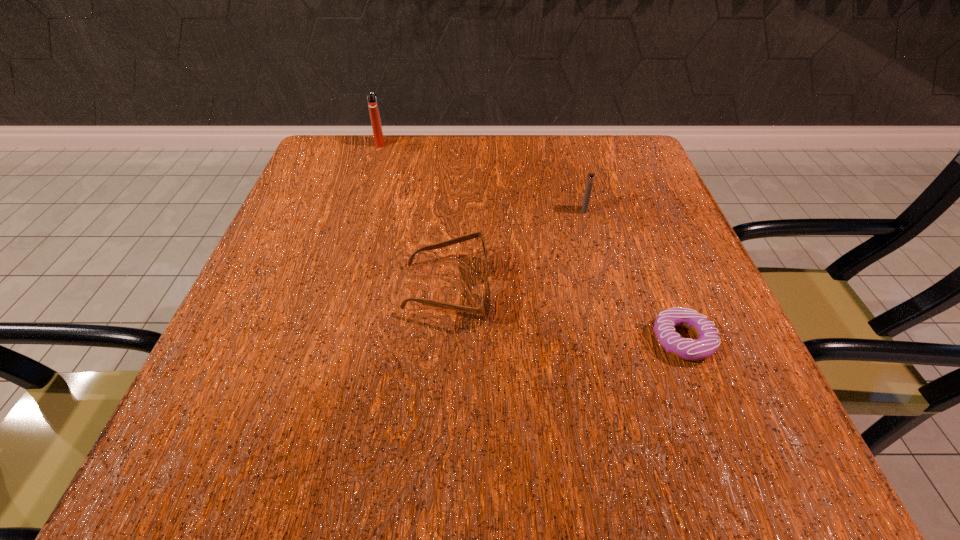
Where is `free space between the shortest object and the tallest object`? The height and width of the screenshot is (540, 960). free space between the shortest object and the tallest object is located at coordinates (531, 241).

The image size is (960, 540). In order to click on empty location between the tallest object and the second shortest object in this screenshot , I will do `click(414, 216)`.

This screenshot has width=960, height=540. Identify the location of vacant area that lies between the doughnut and the nearer igniter. (634, 275).

You are a GUI agent. You are given a task and a screenshot of the screen. Output one action in this format:
    pyautogui.click(x=<x>, y=<y>)
    Task: Click on the object that is the third closest to the left igniter
    This screenshot has width=960, height=540.
    Given the screenshot: What is the action you would take?
    pyautogui.click(x=708, y=341)

Select which object appears as the third closest to the third nearest object. Please provide its 2D coordinates. Your answer should be formatted as a tuple, i.e. [(x, y)], where the tuple contains the x and y coordinates of a point satisfying the conditions above.

[(372, 101)]

The image size is (960, 540). Identify the location of vacant region that satisfies the following two spatial constraints: 1. on the frames of the second object from left to right; 2. on the right side of the doughnut. (444, 340).

Identify the location of vacant space that satisfies the following two spatial constraints: 1. on the front side of the second object from right to left; 2. on the right side of the rightmost object. pos(619,340).

At what (x,y) coordinates should I click in order to perform the action: click on vacant point that satisfies the following two spatial constraints: 1. on the frames of the third object from right to left; 2. on the right side of the shortest object. Please return your answer as a coordinate pair (x, y). Image resolution: width=960 pixels, height=540 pixels. Looking at the image, I should click on (444, 340).

What are the coordinates of `free space that satisfies the following two spatial constraints: 1. on the front side of the tallest object; 2. on the right side of the rightmost object` in the screenshot? It's located at (319, 340).

This screenshot has height=540, width=960. I want to click on vacant space that satisfies the following two spatial constraints: 1. on the front side of the shortest object; 2. on the right side of the left igniter, so click(x=319, y=340).